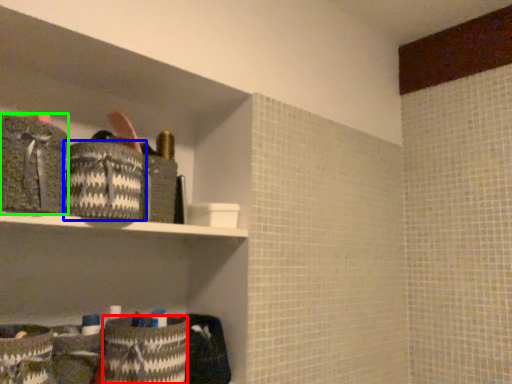
Question: Which object is positioned closest to material (highlighted by a red box)? Select from material (highlighted by a blue box) and material (highlighted by a green box).

Choices:
 (A) material
 (B) material

Answer: (A)